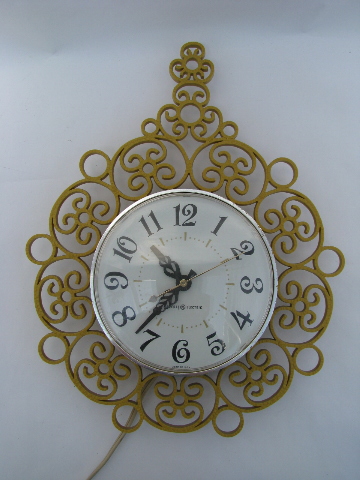
Identify the location of clock hands. The height and width of the screenshot is (480, 360). point(174,267), point(157,309), point(200,274).